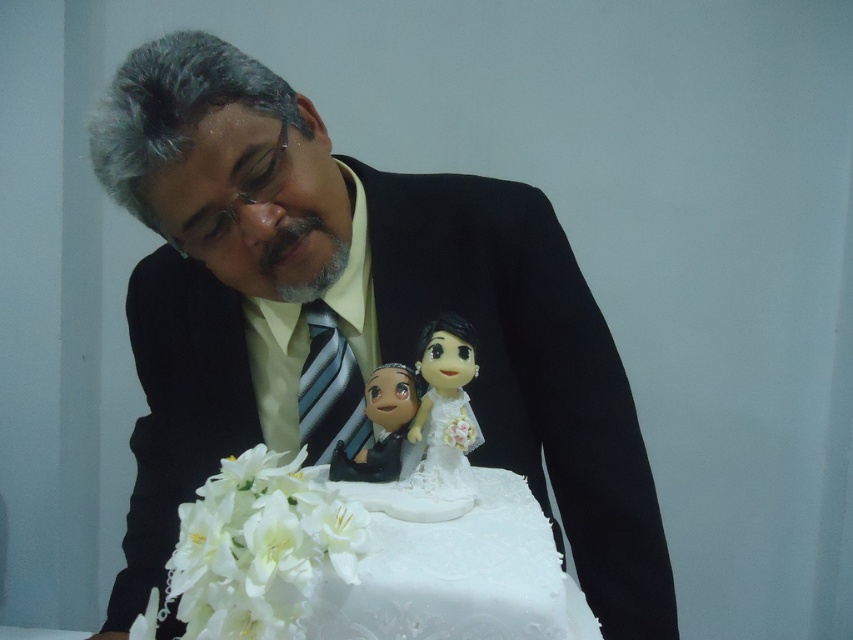
Is point (175, 518) positioned in front of point (395, 428)?

No, (175, 518) is further to viewer.

Between point (367, 198) and point (381, 388), which one is positioned behind?

Positioned behind is point (367, 198).

This screenshot has width=853, height=640. What do you see at coordinates (347, 317) in the screenshot?
I see `matte black suit at center` at bounding box center [347, 317].

The image size is (853, 640). Identify the location of matte black suit at center. (347, 317).

Which is above, matte black suit at center or porcelain doll at center?

Positioned higher is porcelain doll at center.

Describe the element at coordinates (347, 317) in the screenshot. I see `matte black suit at center` at that location.

Where is `matte black suit at center`? The height and width of the screenshot is (640, 853). matte black suit at center is located at coordinates (347, 317).

From the picture: Who is more forward, (445,388) or (405,416)?

Point (445,388) is more forward.

Who is shorter, porcelain doll at center or matte plastic figurine at center?

Standing shorter between the two is matte plastic figurine at center.

The width and height of the screenshot is (853, 640). What do you see at coordinates (444, 412) in the screenshot? I see `porcelain doll at center` at bounding box center [444, 412].

The height and width of the screenshot is (640, 853). What are the coordinates of `porcelain doll at center` in the screenshot? It's located at (444, 412).